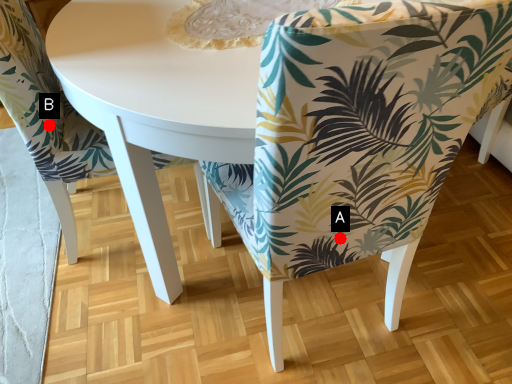
Question: Two points are circled on the image, labeled by A and B beside each circle. Which point is closer to the camera taking this photo?

Choices:
 (A) A is closer
 (B) B is closer

Answer: (A)